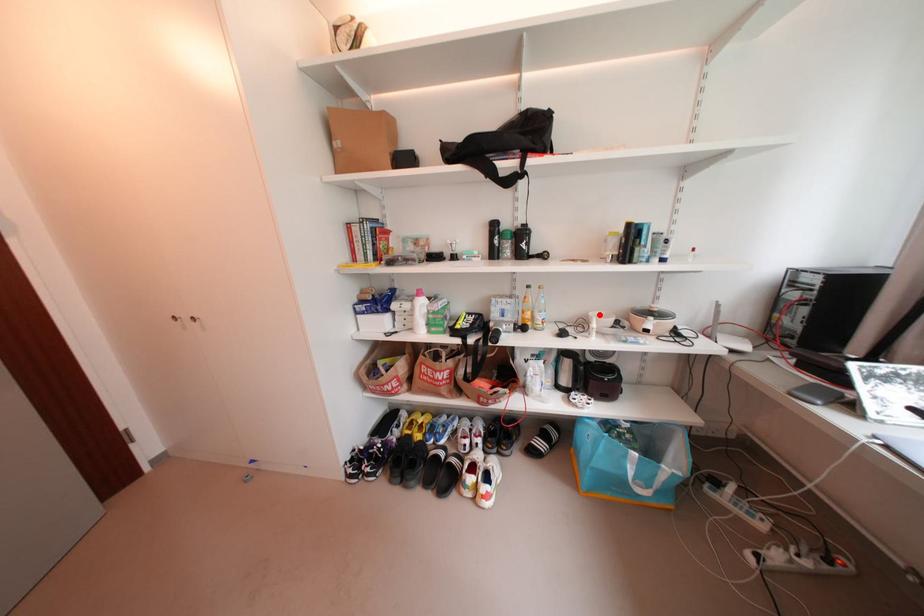
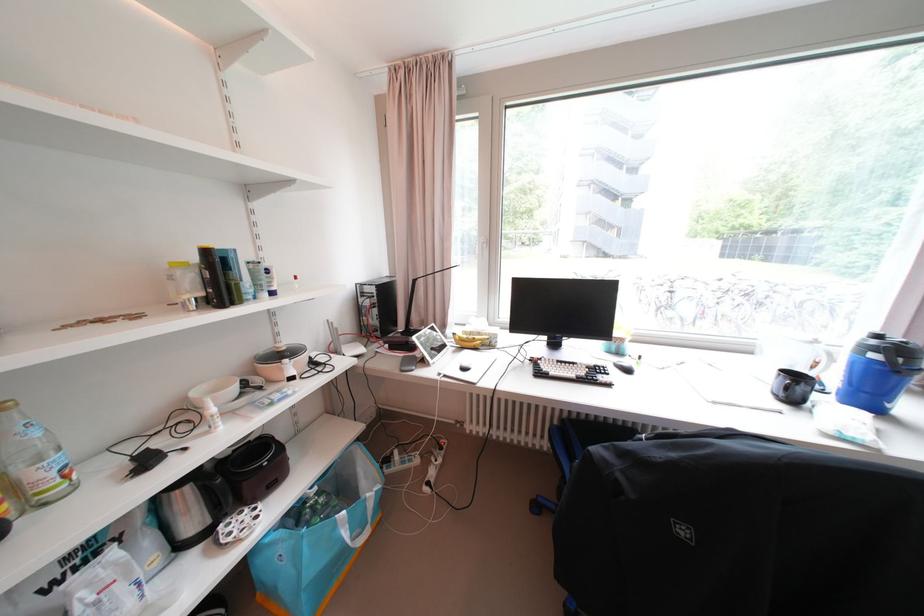
Find the pixel in the second image that matches the highlighted location in the first image.

(202, 395)